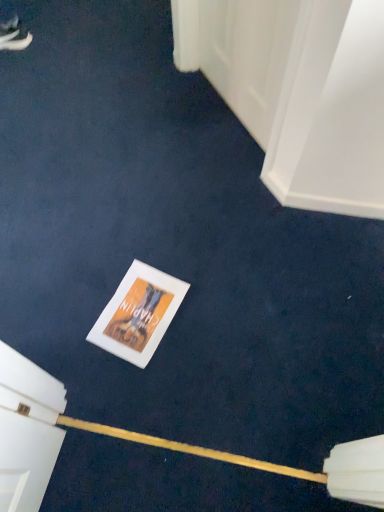
You are a GUI agent. You are given a task and a screenshot of the screen. Output one action in this format:
    pyautogui.click(x=<x>, y=<y>)
    Task: Click on the free space above white glossy picture frame at center (from a real-world perspective)
    This screenshot has height=512, width=384.
    Given the screenshot: What is the action you would take?
    pyautogui.click(x=132, y=309)